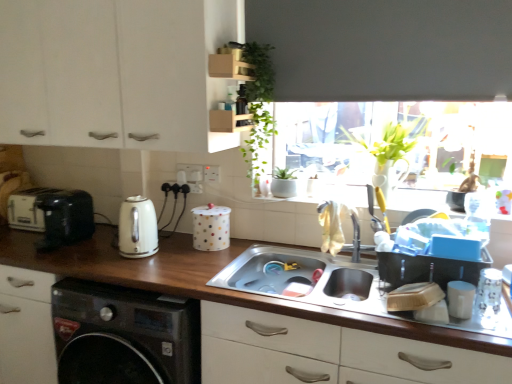
Locate an element on the screen. This screenshot has width=512, height=384. free location in front of matte black toaster at left, the third appliance viewed from the right is located at coordinates (72, 257).